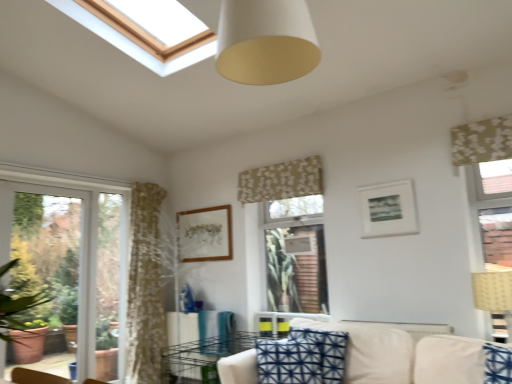
In order to click on empty space that is ontop of floral fabric curtain at center, positioned as the second curtain in right-to-left order (from a real-world perspective) in this screenshot , I will do `click(275, 163)`.